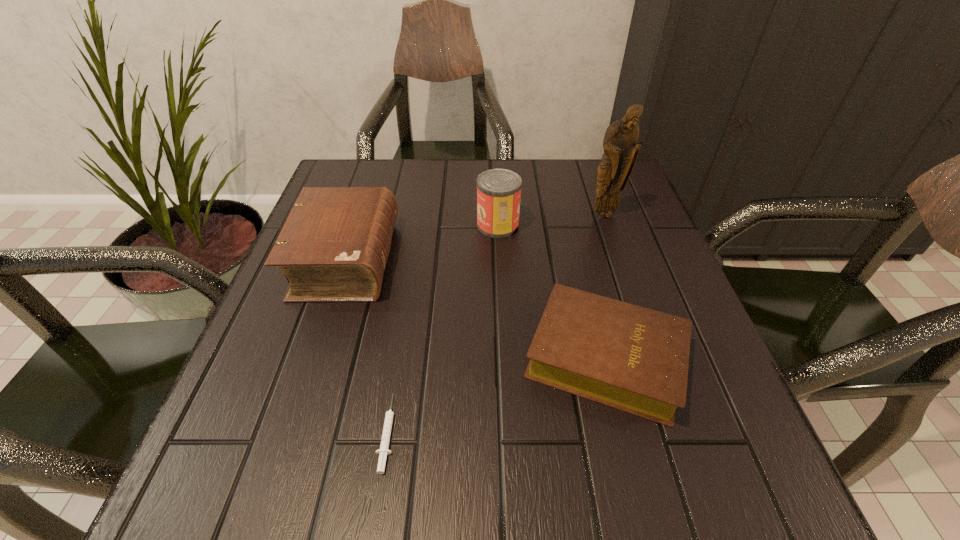
Locate an element on the screen. The image size is (960, 540). free space at the near edge is located at coordinates (332, 480).

At what (x,y) coordinates should I click in order to perform the action: click on vacant space at the left edge. Please return your answer as a coordinate pair (x, y). Image resolution: width=960 pixels, height=540 pixels. Looking at the image, I should click on (274, 447).

Identify the location of vacant space at the right edge of the desktop. (698, 348).

Image resolution: width=960 pixels, height=540 pixels. In the image, there is a desktop. In order to click on blank space at the far left corner in this screenshot , I will do `click(360, 185)`.

Identify the location of vacant point at the near left corner. Image resolution: width=960 pixels, height=540 pixels. (309, 459).

Where is `vacant region between the right Bible and the farther Bible`? The width and height of the screenshot is (960, 540). vacant region between the right Bible and the farther Bible is located at coordinates (476, 309).

Identify the location of vacant space that is in between the nearer Bible and the can. (552, 292).

Where is `vacant space that's between the figurine and the can`? This screenshot has width=960, height=540. vacant space that's between the figurine and the can is located at coordinates (551, 220).

Locate an element on the screen. This screenshot has height=540, width=960. empty space that is in between the shortest object and the shorter Bible is located at coordinates (497, 395).

This screenshot has width=960, height=540. Find the location of `free spot between the can and the tallest object`. free spot between the can and the tallest object is located at coordinates (551, 220).